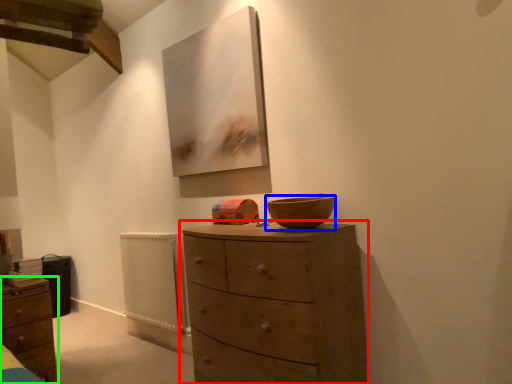
Question: Which is farther away from chest of drawers (highlighted by a red box)? bowl (highlighted by a blue box) or chest of drawers (highlighted by a green box)?

Choices:
 (A) bowl
 (B) chest of drawers

Answer: (B)